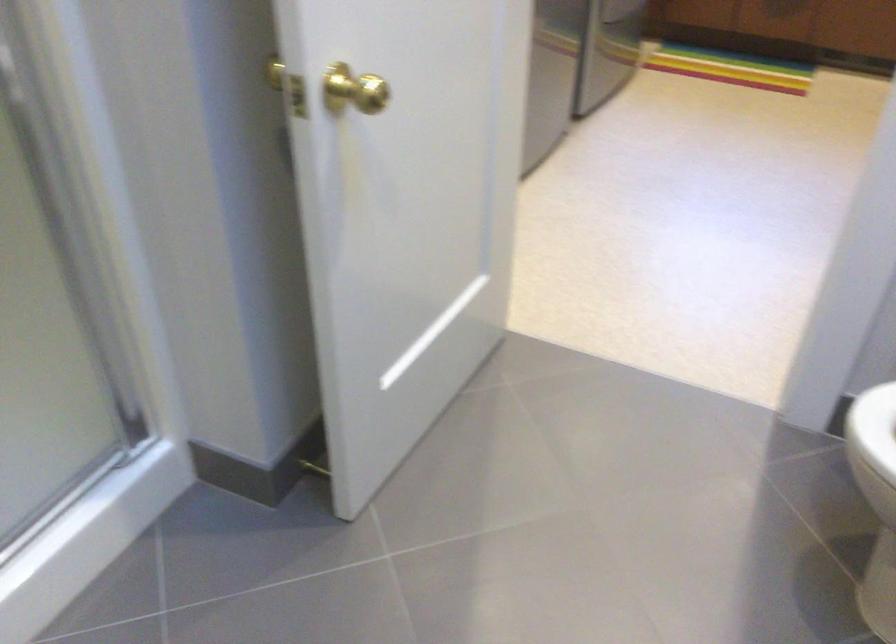
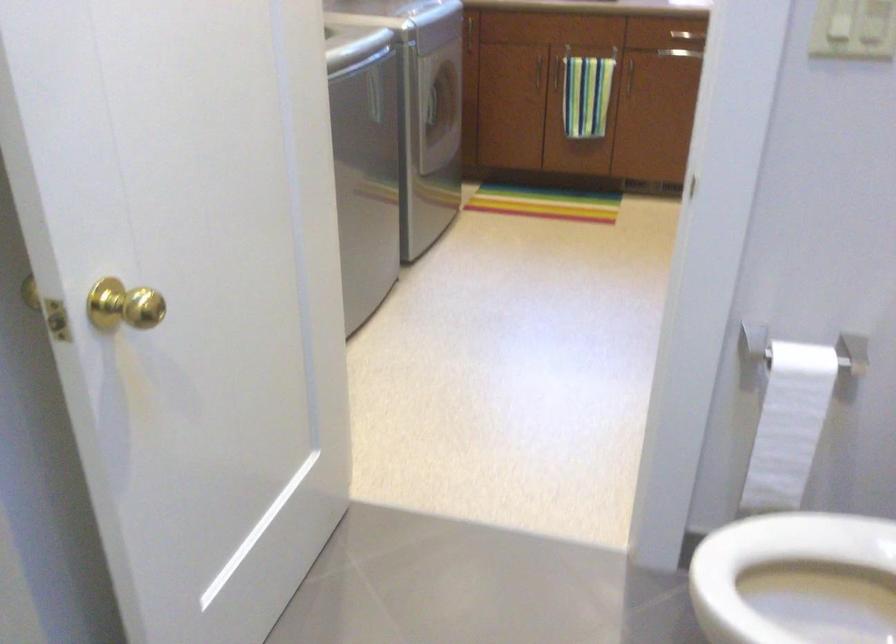
Question: The camera is either moving clockwise (left) or counter-clockwise (right) around the object. The first image is from the beginning of the video and the second image is from the end. Is the camera moving left or right when shooting the video?

Choices:
 (A) Left
 (B) Right

Answer: (A)